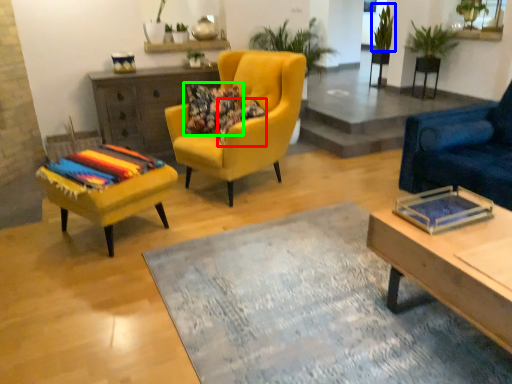
Question: Which object is the closest to the pillow (highlighted by a red box)? Choose among these: plant (highlighted by a blue box) or pillow (highlighted by a green box).

Choices:
 (A) plant
 (B) pillow

Answer: (B)